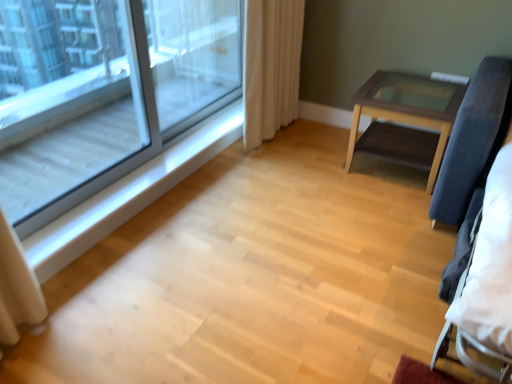
Question: Should I look upward or downward to see beige fabric curtain at upper right?

Choices:
 (A) down
 (B) up

Answer: (B)

Question: Are clear glass window at upper left and white wood at left making contact?

Choices:
 (A) no
 (B) yes

Answer: (A)

Question: From the image's perspective, is clear glass window at upper left located above white wood at left?

Choices:
 (A) yes
 (B) no

Answer: (A)

Question: Is clear glass window at upper left bigger than white wood at left?

Choices:
 (A) no
 (B) yes

Answer: (A)

Question: Is clear glass window at upper left positioned with its back to white wood at left?

Choices:
 (A) no
 (B) yes

Answer: (A)

Question: Is clear glass window at upper left behind white wood at left?

Choices:
 (A) no
 (B) yes

Answer: (A)

Question: Can white wood at left be found inside clear glass window at upper left?

Choices:
 (A) no
 (B) yes

Answer: (A)

Question: Is white wood at left to the right of transparent glass screen door at upper left from the viewer's perspective?

Choices:
 (A) no
 (B) yes

Answer: (A)

Question: Can you confirm if white wood at left is positioned to the left of transparent glass screen door at upper left?

Choices:
 (A) no
 (B) yes

Answer: (B)

Question: Is white wood at left thinner than transparent glass screen door at upper left?

Choices:
 (A) yes
 (B) no

Answer: (B)

Question: Does white wood at left have a smaller size compared to transparent glass screen door at upper left?

Choices:
 (A) no
 (B) yes

Answer: (A)

Question: Is white wood at left touching transparent glass screen door at upper left?

Choices:
 (A) no
 (B) yes

Answer: (A)

Question: Is the depth of white wood at left greater than that of transparent glass screen door at upper left?

Choices:
 (A) no
 (B) yes

Answer: (A)

Question: Is transparent glass screen door at upper left positioned in front of clear glass window at upper left?

Choices:
 (A) no
 (B) yes

Answer: (A)